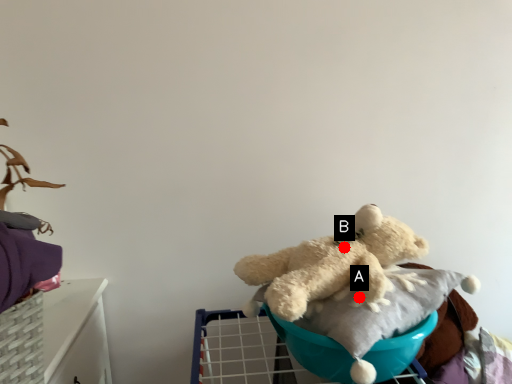
Question: Two points are circled on the image, labeled by A and B beside each circle. Which point is farther from the camera taking this photo?

Choices:
 (A) A is further
 (B) B is further

Answer: (B)